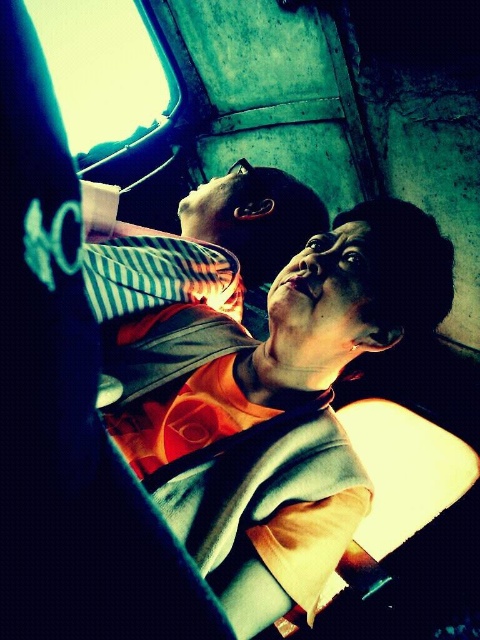
You are a passenger on a bus and want to rest your head on the striped fabric pillow at upper center. However, you notice the transparent glass window at upper left is in the way. Can you move the pillow to a position where it won

The striped fabric pillow at upper center is located below the transparent glass window at upper left, so you can move it to a position above or beside the window to rest your head without obstruction.

Based on the photo, you are a passenger on a bus and want to rest your head on the striped fabric pillow at upper center while looking out the transparent glass window at upper left. Can you do this comfortably without moving the pillow?

The striped fabric pillow at upper center is positioned on the right side of transparent glass window at upper left, so you can rest your head on the striped fabric pillow at upper center while looking out the transparent glass window at upper left comfortably without moving the pillow.

You are a passenger on a train and need to rest your head. You see a striped fabric pillow at upper center and a transparent glass window at upper left. Which object is shorter and can you use it to rest your head?

The striped fabric pillow at upper center is shorter than the transparent glass window at upper left. Since the pillow is shorter, it might not provide enough support for resting your head comfortably. Consider using the window instead for better support.